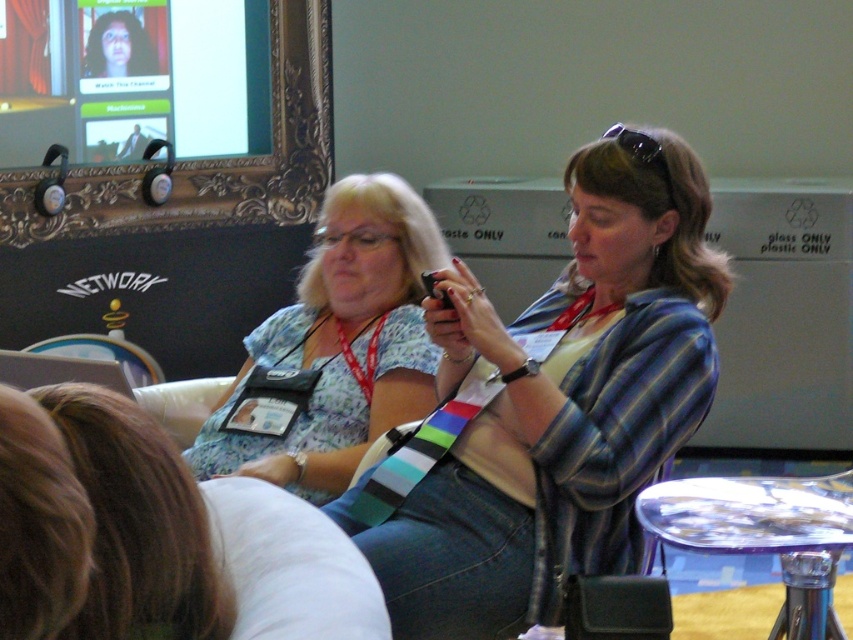
Which of these two, striped fabric shirt at center or brown hair at lower left, stands shorter?

With less height is brown hair at lower left.

Is striped fabric shirt at center below brown hair at lower left?

No.

Which is in front, point (560, 371) or point (149, 548)?

Point (149, 548) is in front.

Where is `striped fabric shirt at center`? The width and height of the screenshot is (853, 640). striped fabric shirt at center is located at coordinates (560, 403).

From the picture: Does floral fabric blouse at center lie in front of transparent plastic stool at lower right?

That is False.

Between floral fabric blouse at center and transparent plastic stool at lower right, which one has more height?

Standing taller between the two is floral fabric blouse at center.

This screenshot has width=853, height=640. Describe the element at coordinates (334, 348) in the screenshot. I see `floral fabric blouse at center` at that location.

In order to click on floral fabric blouse at center in this screenshot , I will do `click(334, 348)`.

Measure the distance from striped fabric shirt at center to transparent plastic stool at lower right.

striped fabric shirt at center and transparent plastic stool at lower right are 13.40 inches apart from each other.

Consider the image. Does striped fabric shirt at center have a greater height compared to transparent plastic stool at lower right?

Yes, striped fabric shirt at center is taller than transparent plastic stool at lower right.

Is point (457, 476) positioned behind point (785, 621)?

Yes.

Locate an element on the screen. striped fabric shirt at center is located at coordinates click(x=560, y=403).